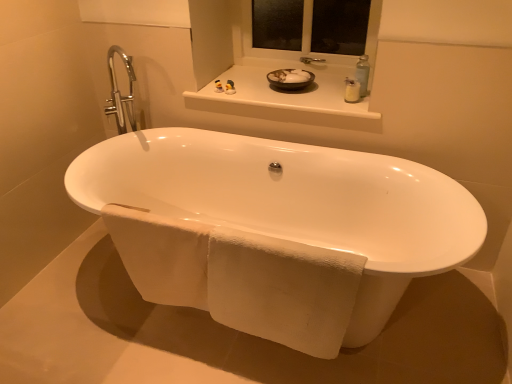
Find the location of `vacant area that lies to the right of matte rubber duck at upper center, acting as the second toiletry starting from the right`. vacant area that lies to the right of matte rubber duck at upper center, acting as the second toiletry starting from the right is located at coordinates (252, 92).